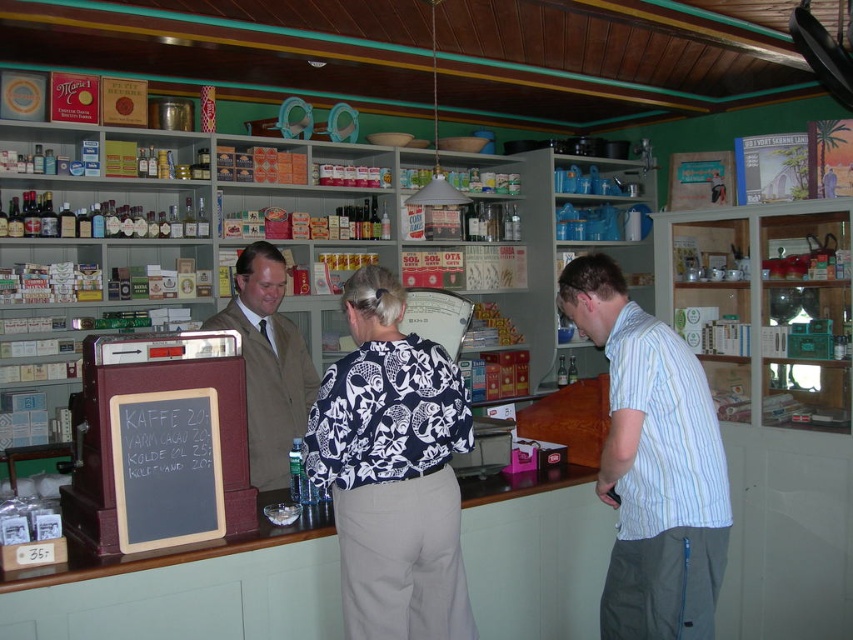
Looking at this image, you are a customer in this vintage shop and see both the floral print blouse at center and the brown leather jacket at center. Which clothing item is positioned lower on the rack?

The floral print blouse at center is located below the brown leather jacket at center, so it is positioned lower on the rack.